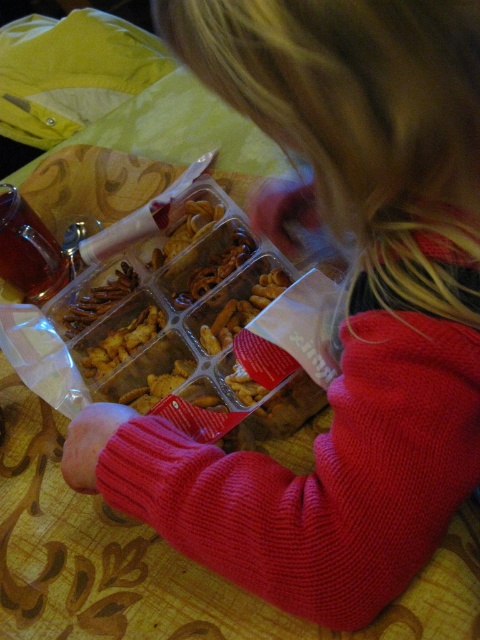
You are a child trying to reach the point marked at coordinates (157, 301) in the image. The point is part of a clear plastic container with snacks. Considering your arm length is 22 inches, can you reach that point?

The point at coordinates (157, 301) is 23.94 inches away from the viewer. Since your arm length is 22 inches, you cannot reach that point as it is slightly farther than your arm length.

Looking at this image, you are a parent trying to ensure your child reaches the snacks safely. The child is currently reaching toward the brown matte pretzel at center. Is the matte plastic snack tray at center positioned in a way that might block their hand from accessing the pretzel?

The matte plastic snack tray at center is to the right of the brown matte pretzel at center, so the tray is not blocking the path to the pretzel. The child can reach the pretzel without obstruction.